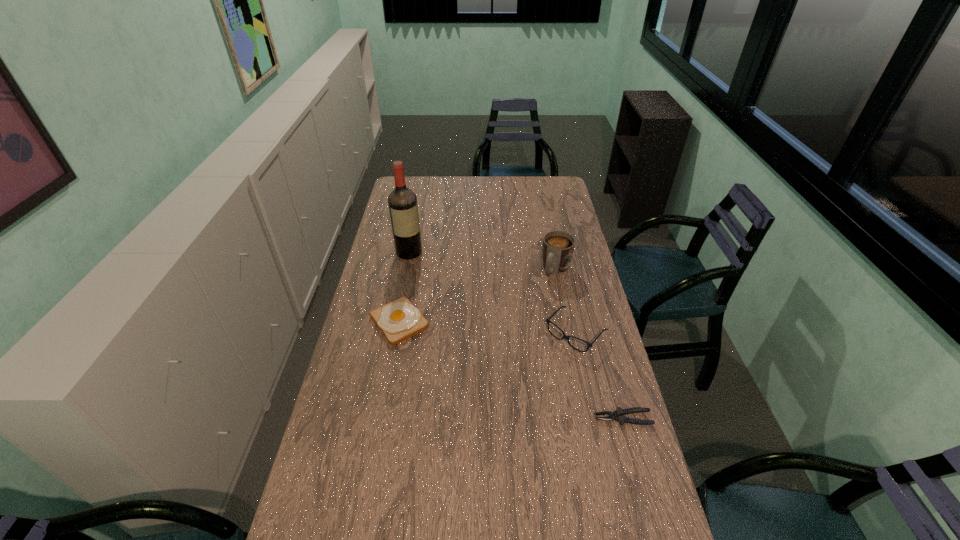
Where is `liquor that is positioned at the left edge`? Image resolution: width=960 pixels, height=540 pixels. liquor that is positioned at the left edge is located at coordinates (403, 208).

Identify the location of pliers that is positioned at the right edge. (618, 415).

You are a GUI agent. You are given a task and a screenshot of the screen. Output one action in this format:
    pyautogui.click(x=<x>, y=<y>)
    Task: Click on the mug present at the right edge
    This screenshot has width=960, height=540.
    Given the screenshot: What is the action you would take?
    pyautogui.click(x=558, y=246)

Find the location of a particular element. The width and height of the screenshot is (960, 540). spectacles present at the right edge is located at coordinates (548, 321).

Where is `vacant area at the far edge`? The height and width of the screenshot is (540, 960). vacant area at the far edge is located at coordinates (465, 190).

Locate an element on the screen. free space at the near edge is located at coordinates (418, 519).

Locate an element on the screen. vacant space at the left edge is located at coordinates (391, 254).

At what (x,y) coordinates should I click in order to perform the action: click on vacant region at the right edge of the desktop. Please return your answer as a coordinate pair (x, y). This screenshot has width=960, height=540. Looking at the image, I should click on (585, 252).

Where is `blank space at the far left corner`? Image resolution: width=960 pixels, height=540 pixels. blank space at the far left corner is located at coordinates (409, 178).

Locate an element on the screen. The image size is (960, 540). vacant space at the far right corner of the desktop is located at coordinates (563, 195).